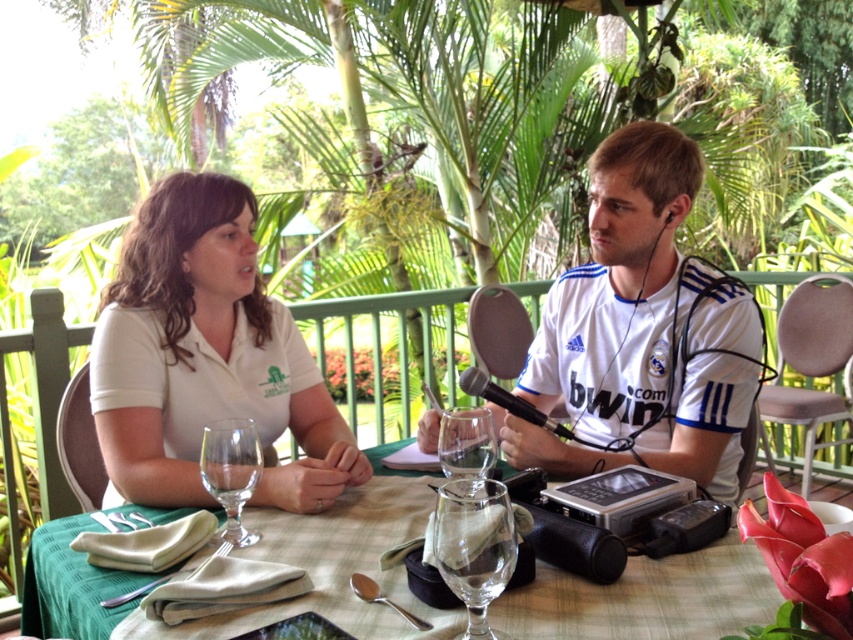
In the scene shown: Does white matte shirt at center appear over transparent glass wine glass at center?

Correct, white matte shirt at center is located above transparent glass wine glass at center.

Between point (106, 442) and point (466, 524), which one is positioned in front?

Point (466, 524) is more forward.

This screenshot has width=853, height=640. Find the location of `white matte shirt at center`. white matte shirt at center is located at coordinates (206, 356).

Which is more to the left, transparent glass at center or silver spoon at lower center?

silver spoon at lower center is more to the left.

Is the position of transparent glass at center less distant than that of silver spoon at lower center?

That is False.

The image size is (853, 640). What do you see at coordinates (466, 444) in the screenshot? I see `transparent glass at center` at bounding box center [466, 444].

Where is `transparent glass at center`? The height and width of the screenshot is (640, 853). transparent glass at center is located at coordinates (466, 444).

Between white matte shirt at upper left and transparent glass wine glass at center, which one has more height?

Standing taller between the two is white matte shirt at upper left.

Which is in front, point (680, 444) or point (444, 508)?

Positioned in front is point (444, 508).

Which is in front, point (653, 166) or point (495, 545)?

Positioned in front is point (495, 545).

Locate an element on the screen. The image size is (853, 640). white matte shirt at upper left is located at coordinates (641, 330).